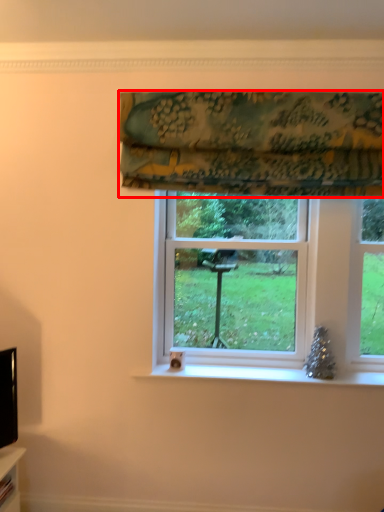
Question: From the image's perspective, where is curtain (annotated by the red box) located in relation to bay window in the image?

Choices:
 (A) above
 (B) below

Answer: (A)